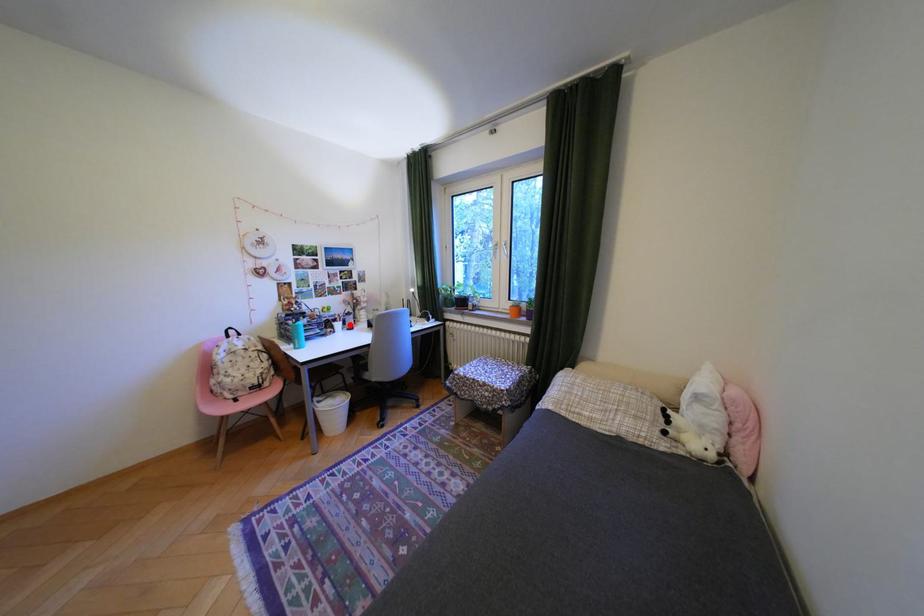
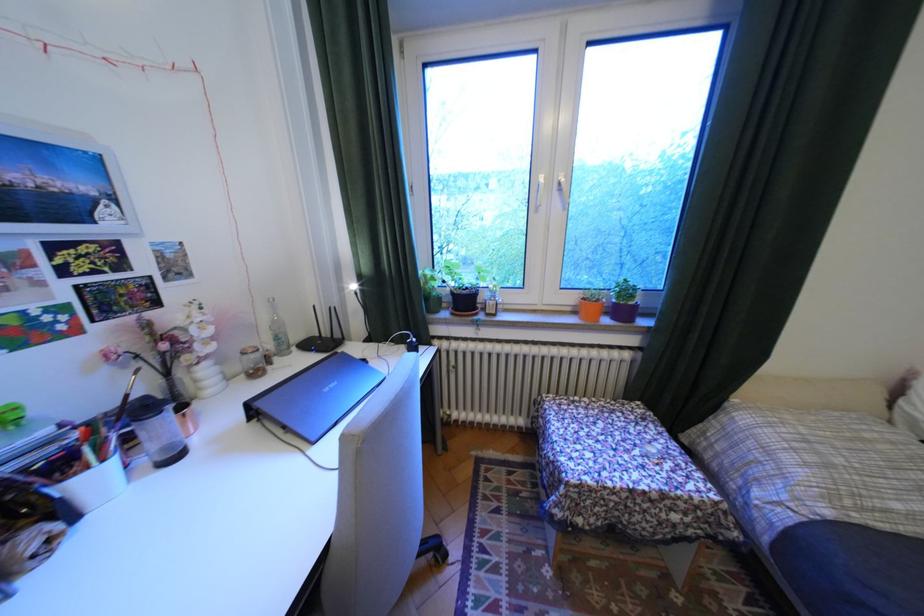
Locate, in the second image, the point that corresponds to the highlighted location in the first image.

(106, 479)